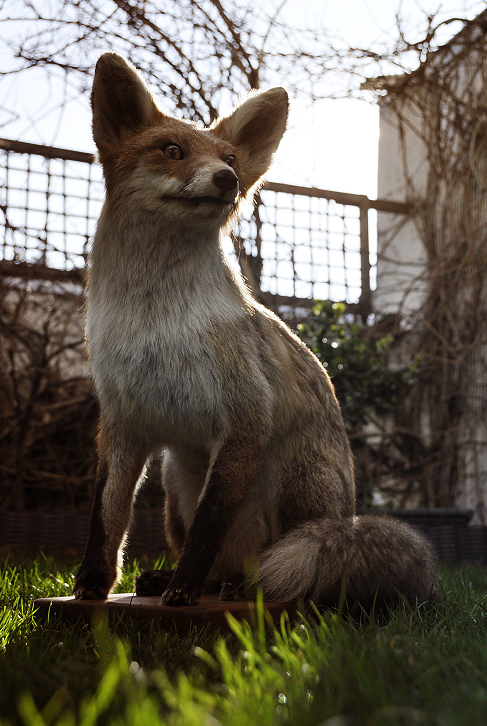
Where is `green plant`? The width and height of the screenshot is (487, 726). green plant is located at coordinates (368, 364).